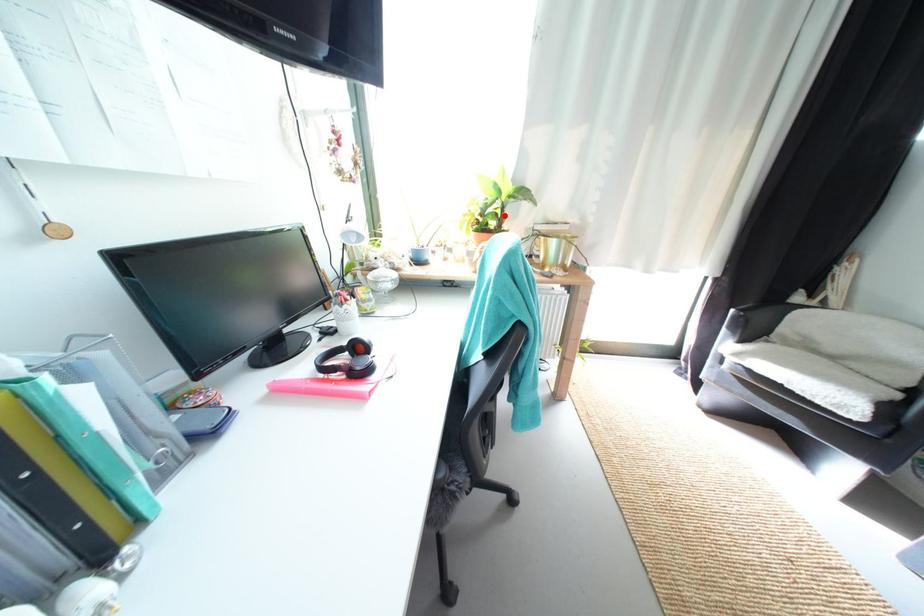
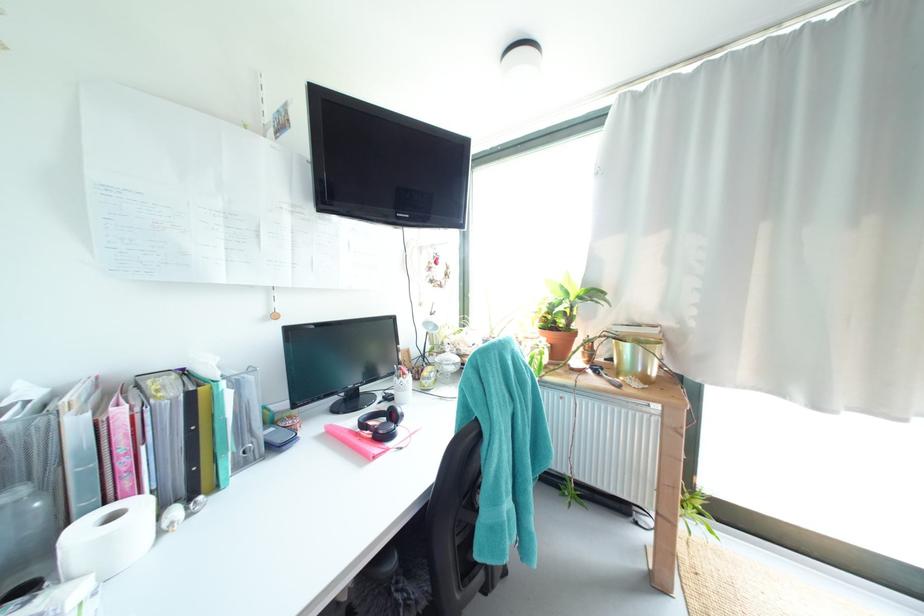
Locate, in the second image, the point that corresponds to the highlighted location in the first image.

(573, 315)